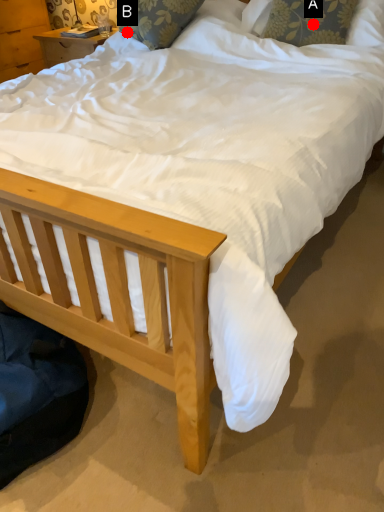
Question: Two points are circled on the image, labeled by A and B beside each circle. Which of the following is the farthest from the observer?

Choices:
 (A) A is further
 (B) B is further

Answer: (B)